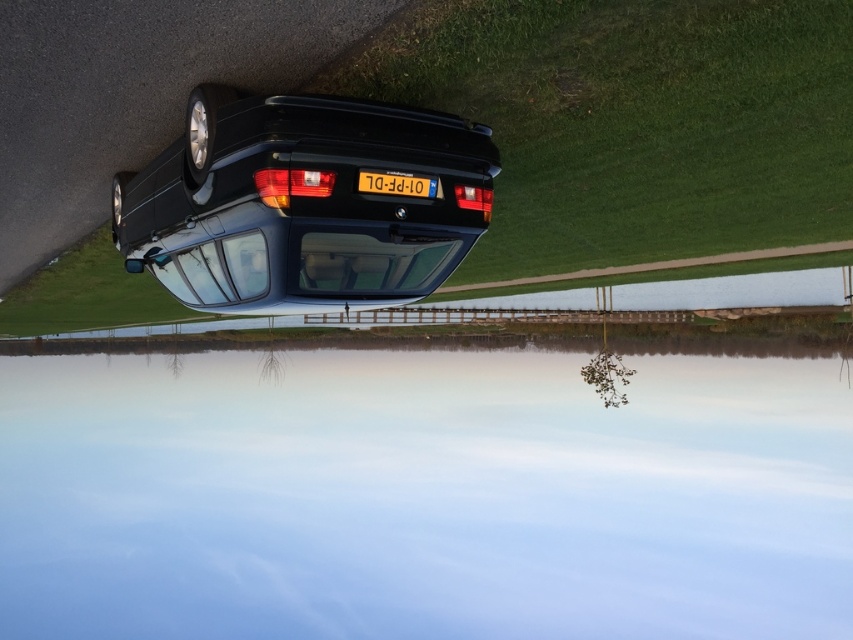
Question: Which object is farther from the camera taking this photo?

Choices:
 (A) matte plastic tail light at center
 (B) transparent glass water at center
 (C) glossy black car at center

Answer: (B)

Question: Can you confirm if transparent glass water at center is smaller than matte plastic tail light at center?

Choices:
 (A) yes
 (B) no

Answer: (B)

Question: Observing the image, what is the correct spatial positioning of matte plastic tail light at center in reference to yellow plastic license plate at center?

Choices:
 (A) above
 (B) below

Answer: (B)

Question: Which object appears closest to the camera in this image?

Choices:
 (A) transparent glass water at center
 (B) matte plastic tail light at center

Answer: (B)

Question: Which object is closer to the camera taking this photo?

Choices:
 (A) glossy black car at center
 (B) transparent glass water at center

Answer: (A)

Question: Is transparent glass water at center behind yellow plastic license plate at center?

Choices:
 (A) no
 (B) yes

Answer: (B)